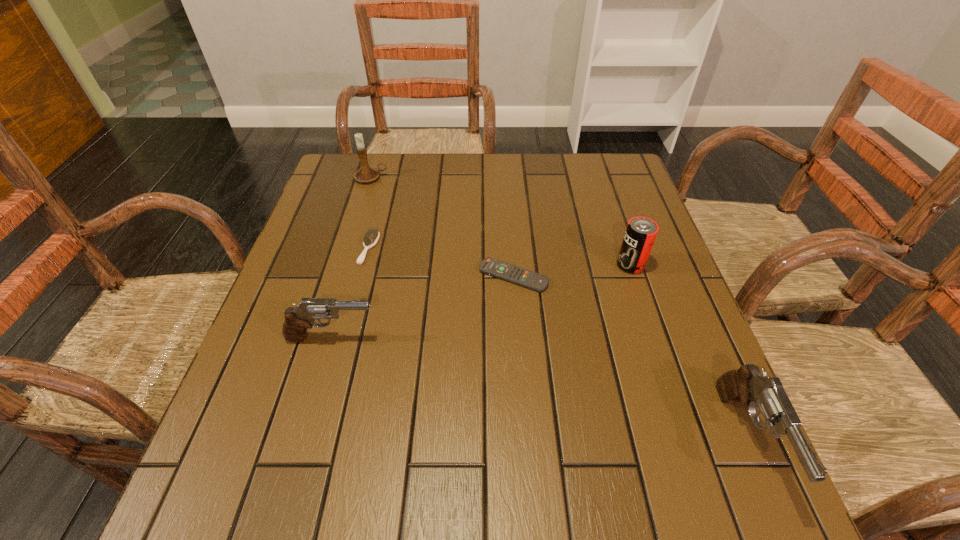
Identify the location of the second nearest object. The height and width of the screenshot is (540, 960). (297, 319).

At what (x,y) coordinates should I click in order to perform the action: click on the left pistol. Please return your answer as a coordinate pair (x, y). The width and height of the screenshot is (960, 540). Looking at the image, I should click on (297, 319).

Where is `the taller pistol`? the taller pistol is located at coordinates (746, 385).

At what (x,y) coordinates should I click in order to perform the action: click on the nearer pistol. Please return your answer as a coordinate pair (x, y). Image resolution: width=960 pixels, height=540 pixels. Looking at the image, I should click on (746, 385).

Image resolution: width=960 pixels, height=540 pixels. Find the location of `candle holder`. candle holder is located at coordinates (366, 174).

This screenshot has height=540, width=960. I want to click on the fifth object from left to right, so click(641, 232).

This screenshot has height=540, width=960. Find the location of `the shortest object`. the shortest object is located at coordinates (490, 266).

Where is `remote control`? remote control is located at coordinates (490, 266).

Find the location of `the second shortest object`. the second shortest object is located at coordinates (372, 235).

The height and width of the screenshot is (540, 960). Identify the location of free space located at the barrel of the shorter pistol. (500, 338).